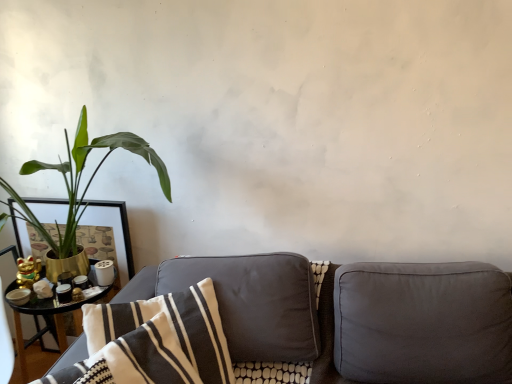
Question: Is point (156, 352) closer or farther from the camera than point (446, 279)?

Choices:
 (A) closer
 (B) farther

Answer: (A)

Question: From a real-world perspective, relative to suede gray couch at lower center, is white striped fabric pillow at center, acting as the first pillow starting from the left, vertically above or below?

Choices:
 (A) above
 (B) below

Answer: (A)

Question: Estimate the real-world distances between objects in this image. Which object is closer to the gold metallic pot at left?

Choices:
 (A) suede-like gray pillow at right, acting as the first pillow starting from the right
 (B) matte black picture frame at left
 (C) suede gray couch at lower center
 (D) white striped fabric pillow at center, acting as the first pillow starting from the left

Answer: (B)

Question: Considering the real-world distances, which object is farthest from the white striped fabric pillow at center, acting as the first pillow starting from the left?

Choices:
 (A) suede-like gray pillow at right, acting as the first pillow starting from the right
 (B) gold metallic pot at left
 (C) matte black picture frame at left
 (D) suede gray couch at lower center

Answer: (C)